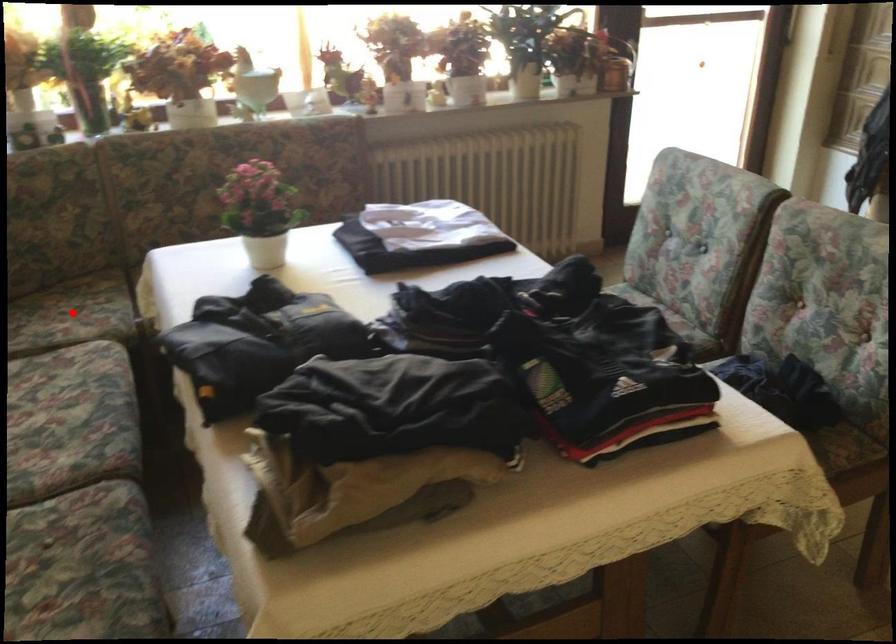
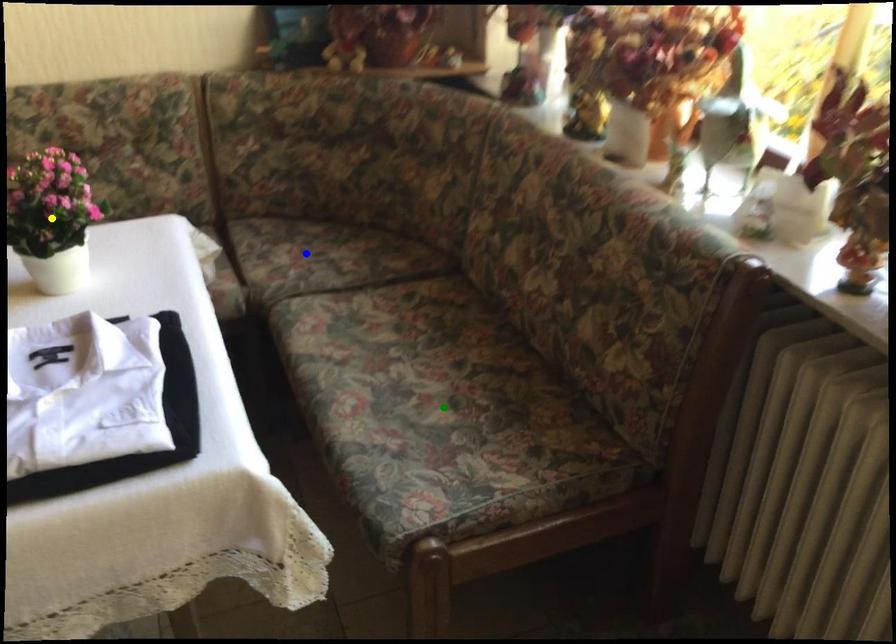
Question: I am providing you with two images of the same scene from different viewpoints. A red point is marked on the first image. You are given multiple points on the second image. Which spot in image 2 lines up with the point in image 1?

Choices:
 (A) green point
 (B) yellow point
 (C) blue point

Answer: (C)